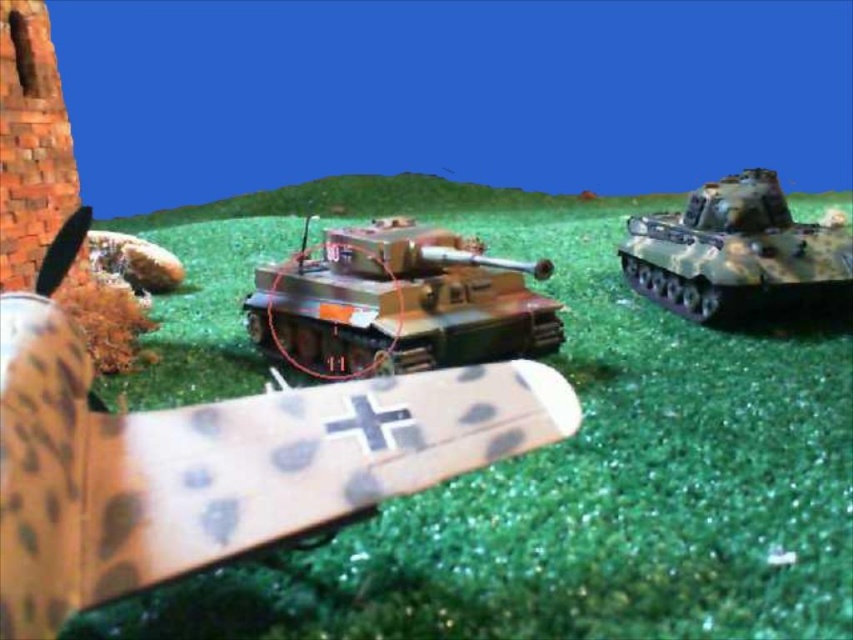
Who is more distant from viewer, (337, 269) or (793, 292)?

Point (793, 292)

Consider the image. Between camouflage paint tank at center and camouflage fabric tank at center, which one appears on the left side from the viewer's perspective?

camouflage paint tank at center is more to the left.

Is point (372, 328) more distant than point (791, 241)?

No.

Find the location of a particular element. The image size is (853, 640). camouflage paint tank at center is located at coordinates (398, 304).

Does camouflage plastic tank at center have a lesser width compared to camouflage paint tank at center?

Yes.

Find the location of a particular element. The image size is (853, 640). camouflage plastic tank at center is located at coordinates (218, 464).

Measure the distance between camouflage plastic tank at center and camera.

26.47 inches

The image size is (853, 640). I want to click on camouflage plastic tank at center, so click(x=218, y=464).

Find the location of a particular element. The width and height of the screenshot is (853, 640). camouflage plastic tank at center is located at coordinates (218, 464).

Locate an element on the screen. This screenshot has width=853, height=640. camouflage plastic tank at center is located at coordinates (218, 464).